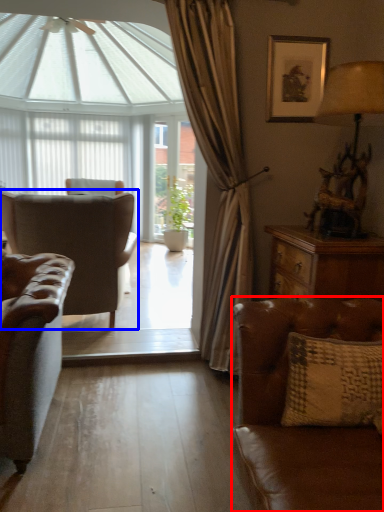
Question: Which point is further to the camera, studio couch (highlighted by a red box) or chair (highlighted by a blue box)?

Choices:
 (A) studio couch
 (B) chair

Answer: (B)